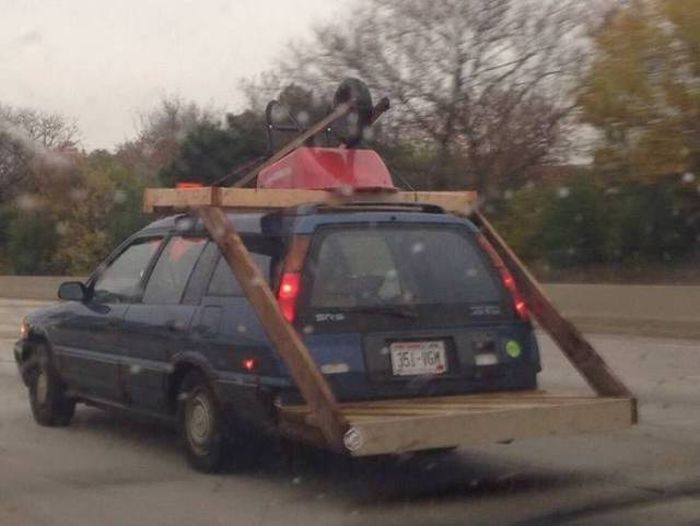
I want to click on window, so click(x=350, y=288), click(x=262, y=260), click(x=183, y=260), click(x=141, y=262).